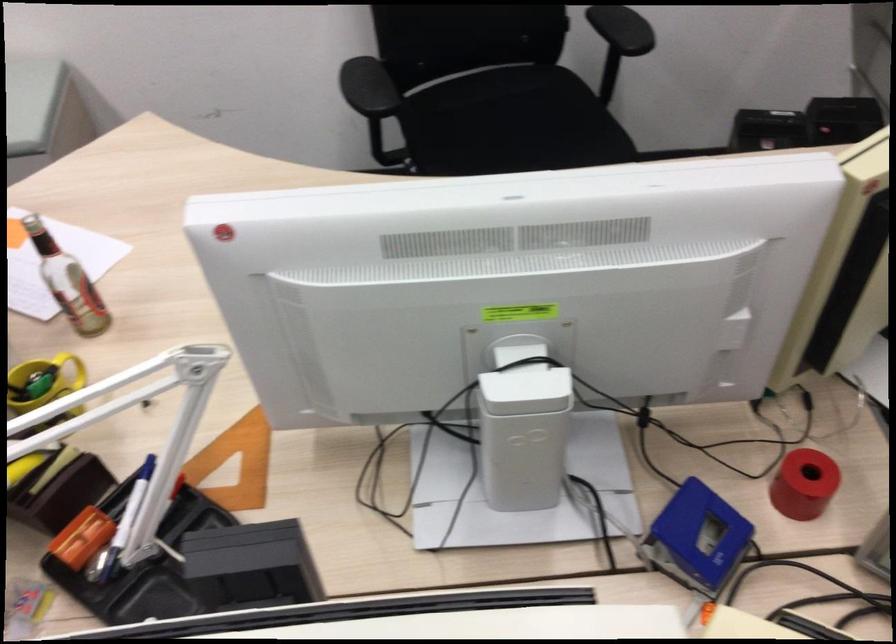
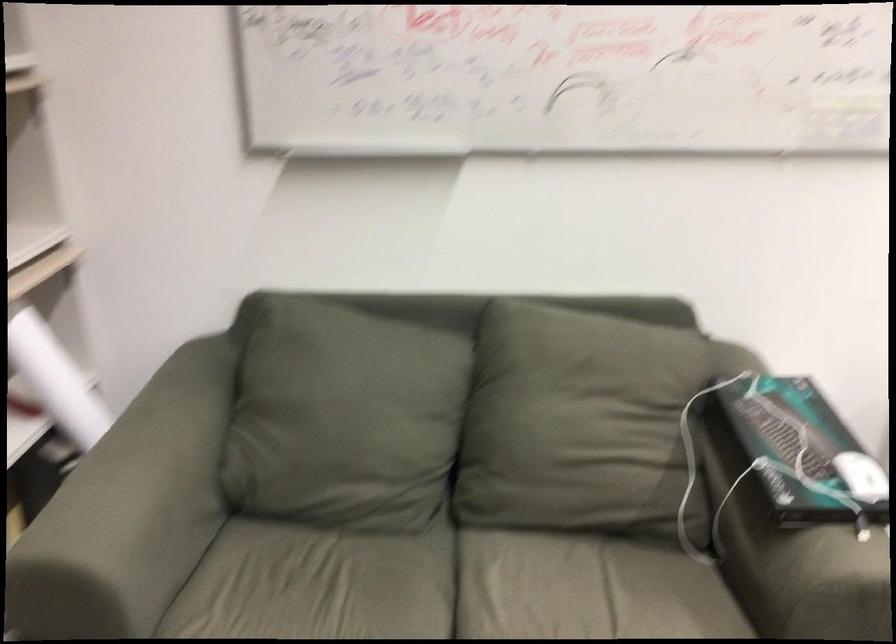
Question: Which direction would the cameraman need to move to produce the second image? Reply with the corresponding letter.

Choices:
 (A) Left
 (B) Right
 (C) Forward
 (D) Backward

Answer: (A)